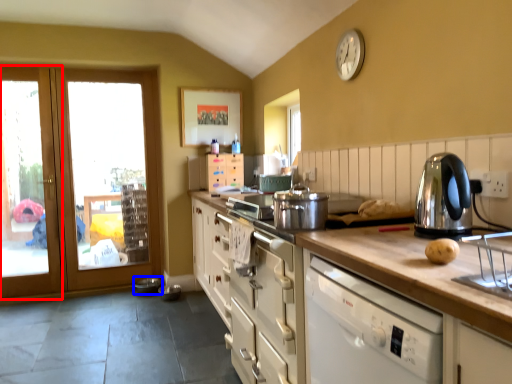
Question: Which of the following is the closest to the observer, screen door (highlighted by a red box) or appliance (highlighted by a blue box)?

Choices:
 (A) screen door
 (B) appliance

Answer: (A)